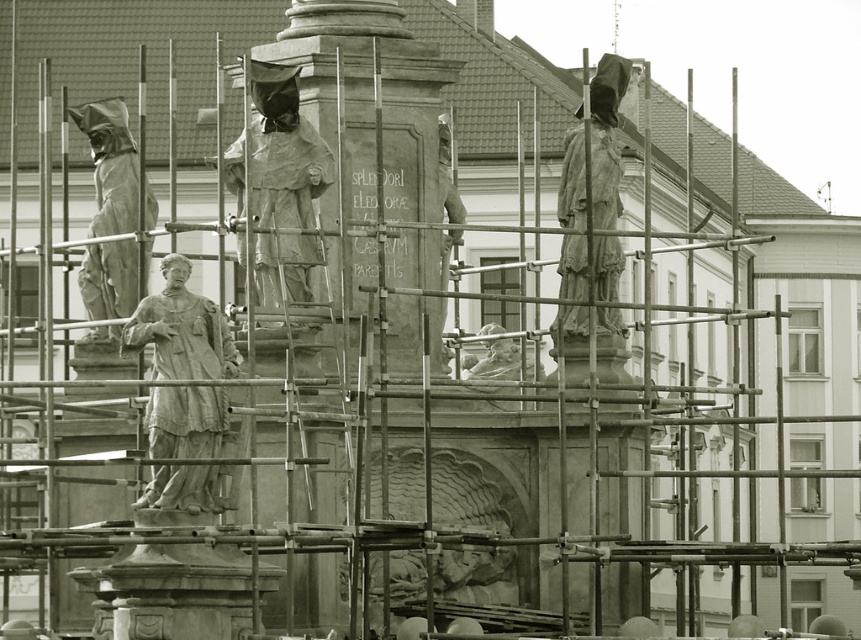
You are an architect assessing the monument layout. You need to determine if the smooth stone statue at center can be moved to the location currently occupied by the matte stone statue at left without removing any scaffolding. Can it fit?

The smooth stone statue at center occupies less space than the matte stone statue at left, so it can fit in the location of the matte stone statue at left without needing to remove scaffolding.